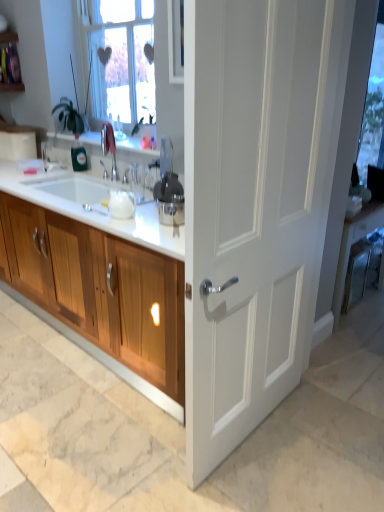
Question: Can you confirm if white matte door at center is thinner than transparent glass window screen at upper right?

Choices:
 (A) yes
 (B) no

Answer: (B)

Question: From the image's perspective, does white matte door at center appear lower than transparent glass window screen at upper right?

Choices:
 (A) no
 (B) yes

Answer: (B)

Question: From a real-world perspective, is white matte door at center physically above transparent glass window screen at upper right?

Choices:
 (A) yes
 (B) no

Answer: (B)

Question: Is white matte door at center smaller than transparent glass window screen at upper right?

Choices:
 (A) yes
 (B) no

Answer: (B)

Question: Does white matte door at center appear on the left side of transparent glass window screen at upper right?

Choices:
 (A) no
 (B) yes

Answer: (B)

Question: Is white matte door at center wider than transparent glass window screen at upper right?

Choices:
 (A) no
 (B) yes

Answer: (B)

Question: Is white matte door at center aimed at satin silver juicer at center?

Choices:
 (A) yes
 (B) no

Answer: (A)

Question: From a real-world perspective, is white matte door at center on top of satin silver juicer at center?

Choices:
 (A) no
 (B) yes

Answer: (A)

Question: Is white matte door at center thinner than satin silver juicer at center?

Choices:
 (A) no
 (B) yes

Answer: (B)

Question: Is white matte door at center next to satin silver juicer at center?

Choices:
 (A) yes
 (B) no

Answer: (B)

Question: Is satin silver juicer at center surrounded by white matte door at center?

Choices:
 (A) no
 (B) yes

Answer: (A)

Question: From a real-world perspective, is white matte door at center under satin silver juicer at center?

Choices:
 (A) yes
 (B) no

Answer: (A)

Question: Is white matte door at center surrounded by wooden cabinet at left?

Choices:
 (A) yes
 (B) no

Answer: (B)